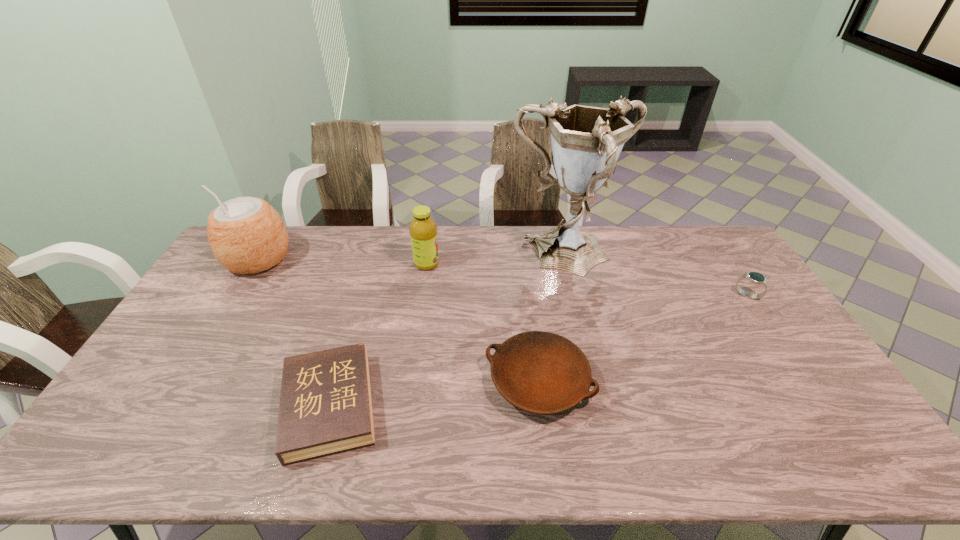
Find the location of `trophy cup`. trophy cup is located at coordinates (586, 141).

Locate an element on the screen. The width and height of the screenshot is (960, 540). the leftmost object is located at coordinates point(246,234).

Image resolution: width=960 pixels, height=540 pixels. Find the location of `the fifth shortest object`. the fifth shortest object is located at coordinates (246, 234).

What are the coordinates of `the fourth object from right to left` in the screenshot? It's located at (423, 230).

The width and height of the screenshot is (960, 540). Find the location of `fruit juice`. fruit juice is located at coordinates (423, 230).

At what (x,y) coordinates should I click in order to perform the action: click on watch. Please return your answer as a coordinate pair (x, y). The image size is (960, 540). Looking at the image, I should click on (754, 277).

Find the location of `plate`. plate is located at coordinates (539, 372).

Locate an element on the screen. Image resolution: width=960 pixels, height=540 pixels. the shortest object is located at coordinates (325, 406).

Image resolution: width=960 pixels, height=540 pixels. In order to click on hardback book in this screenshot , I will do `click(325, 406)`.

Locate an element on the screen. The image size is (960, 540). vacant space located 0.310m on the right of the trophy cup is located at coordinates (712, 258).